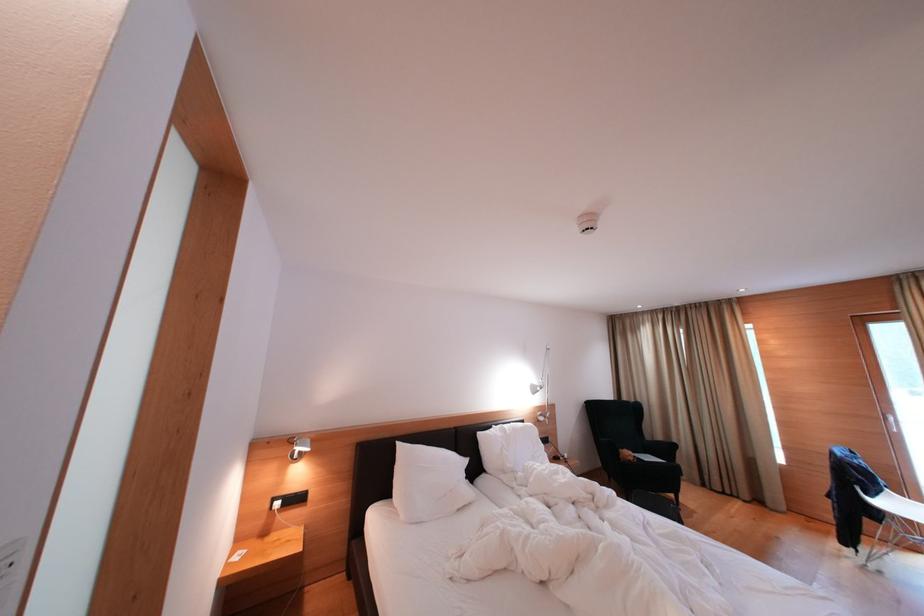
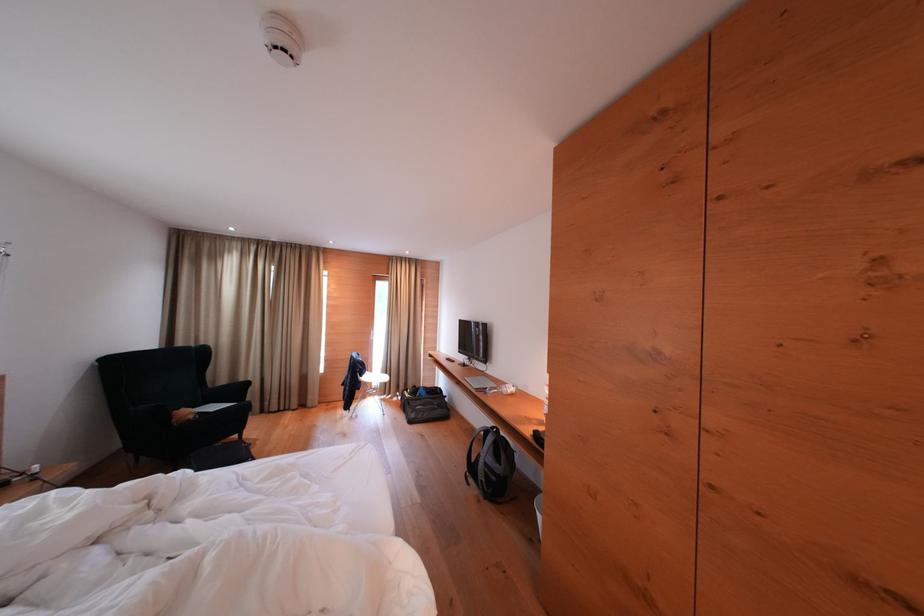
Where in the second image is the point corresponding to point (638, 463) from the first image?

(198, 421)